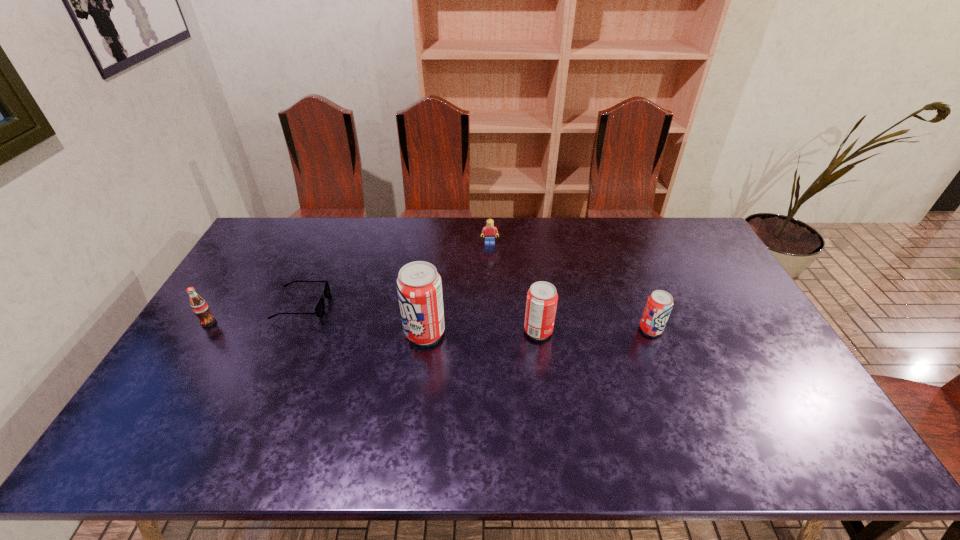
Image resolution: width=960 pixels, height=540 pixels. I want to click on the tallest soda, so click(x=419, y=287).

At what (x,y) coordinates should I click in order to perform the action: click on the second soda from left to right. Please return your answer as a coordinate pair (x, y). The height and width of the screenshot is (540, 960). Looking at the image, I should click on (419, 287).

Find the location of a particular element. the fifth shortest object is located at coordinates (541, 303).

You are a GUI agent. You are given a task and a screenshot of the screen. Output one action in this format:
    pyautogui.click(x=<x>, y=<y>)
    Task: Click on the fifth object from left to right
    This screenshot has height=540, width=960.
    Given the screenshot: What is the action you would take?
    pyautogui.click(x=541, y=303)

At what (x,y) coordinates should I click in order to perform the action: click on the rightmost soda. Please return your answer as a coordinate pair (x, y). Looking at the image, I should click on (660, 303).

You are a GUI agent. You are given a task and a screenshot of the screen. Output one action in this format:
    pyautogui.click(x=<x>, y=<y>)
    Task: Click on the second shortest object
    The height and width of the screenshot is (540, 960).
    Given the screenshot: What is the action you would take?
    pyautogui.click(x=489, y=230)

Locate an element on the screen. This screenshot has width=960, height=540. Lego is located at coordinates pos(489,230).

This screenshot has height=540, width=960. I want to click on the shortest object, so click(x=319, y=310).

Identify the location of the fifth object from right to left. This screenshot has width=960, height=540. (319, 310).

The width and height of the screenshot is (960, 540). I want to click on the leftmost object, so click(199, 306).